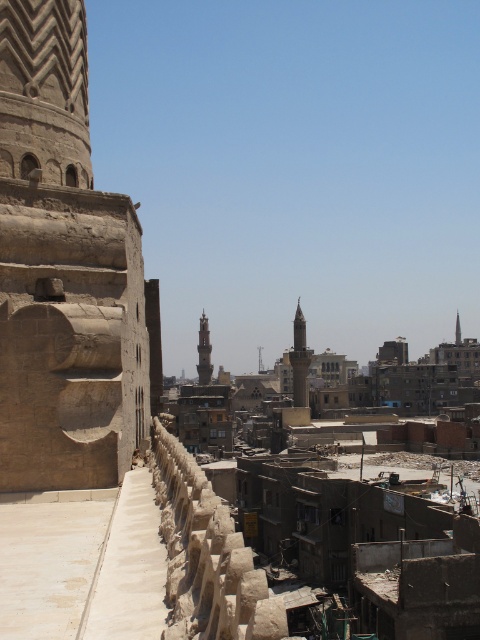
You are an architect analyzing the minarets in the image. Which minaret, the light brown stone minaret at center or the smooth stone minaret at center, is taller?

The light brown stone minaret at center is much taller than the smooth stone minaret at center.

You are an urban planner analyzing the spatial distribution of historical structures in this Middle Eastern city. Given the presence of the light brown stone minaret at center and the brown stone tower at center, which structure takes up more area in the image?

The brown stone tower at center occupies more space than the light brown stone minaret at center, so it takes up more area in the image.

You are a drone operator tasked with capturing aerial footage of the light brown stone minaret at center and the smooth stone minaret at center. Your drone has a maximum flight range of 150 meters. Can you fly the drone from one minaret to the other without exceeding its range?

The distance between the light brown stone minaret at center and the smooth stone minaret at center is 125.19 meters, which is within the drone operator drone operator drone operator drone operator maximum flight range of 150 meters. Yes, the drone can fly from one minaret to the other without exceeding its range.